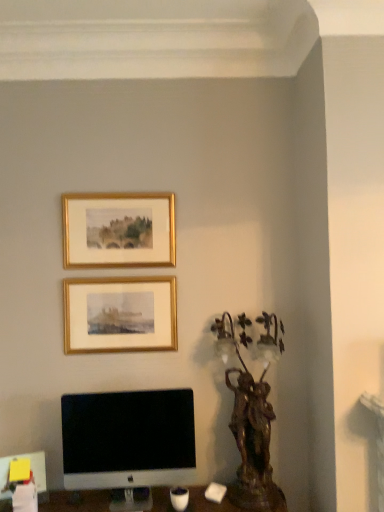
Question: From the image's perspective, does bronze statue at right appear higher than white glossy computer monitor at lower left?

Choices:
 (A) no
 (B) yes

Answer: (B)

Question: Is bronze statue at right to the left of white glossy computer monitor at lower left from the viewer's perspective?

Choices:
 (A) yes
 (B) no

Answer: (B)

Question: Does bronze statue at right have a greater width compared to white glossy computer monitor at lower left?

Choices:
 (A) no
 (B) yes

Answer: (B)

Question: Can you confirm if bronze statue at right is thinner than white glossy computer monitor at lower left?

Choices:
 (A) yes
 (B) no

Answer: (B)

Question: Would you consider bronze statue at right to be distant from white glossy computer monitor at lower left?

Choices:
 (A) yes
 (B) no

Answer: (B)

Question: In terms of size, does gold/gilded picture frame at upper center, the 1th picture frame from the bottom, appear bigger or smaller than bronze statue at right?

Choices:
 (A) big
 (B) small

Answer: (B)

Question: Is point (148, 332) positioned closer to the camera than point (236, 493)?

Choices:
 (A) farther
 (B) closer

Answer: (A)

Question: From a real-world perspective, relative to bronze statue at right, is gold/gilded picture frame at upper center, the 1th picture frame from the bottom, vertically above or below?

Choices:
 (A) below
 (B) above

Answer: (B)

Question: Is gold/gilded picture frame at upper center, the 1th picture frame from the bottom, in front of or behind bronze statue at right in the image?

Choices:
 (A) behind
 (B) front

Answer: (A)

Question: Is gold/gilded picture frame at upper center, which is counted as the first picture frame, starting from the top, in front of or behind white glossy computer monitor at lower left in the image?

Choices:
 (A) behind
 (B) front

Answer: (A)

Question: From the image's perspective, is gold/gilded picture frame at upper center, which is counted as the first picture frame, starting from the top, above or below white glossy computer monitor at lower left?

Choices:
 (A) above
 (B) below

Answer: (A)

Question: In terms of height, does gold/gilded picture frame at upper center, which is counted as the first picture frame, starting from the top, look taller or shorter compared to white glossy computer monitor at lower left?

Choices:
 (A) tall
 (B) short

Answer: (B)

Question: Looking at the image, does gold/gilded picture frame at upper center, the 2th picture frame from the bottom, seem bigger or smaller compared to white glossy computer monitor at lower left?

Choices:
 (A) big
 (B) small

Answer: (B)

Question: Would you say bronze statue at right is inside or outside gold/gilded picture frame at upper center, which is counted as the first picture frame, starting from the top?

Choices:
 (A) inside
 (B) outside

Answer: (B)

Question: From the image's perspective, is bronze statue at right above or below gold/gilded picture frame at upper center, the 2th picture frame from the bottom?

Choices:
 (A) below
 (B) above

Answer: (A)